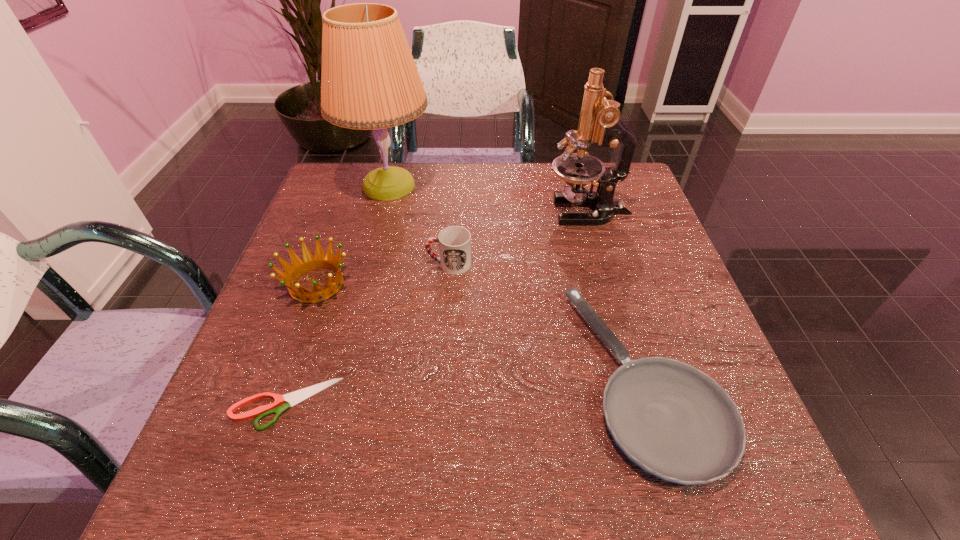
In the image, there is a desktop. Identify the location of vacant space at the right edge. The height and width of the screenshot is (540, 960). (653, 262).

This screenshot has width=960, height=540. In the image, there is a desktop. In order to click on free space at the far left corner in this screenshot , I will do `click(374, 165)`.

I want to click on free point between the cup and the crown, so click(x=383, y=274).

This screenshot has height=540, width=960. In order to click on free space between the microscope and the tallest object in this screenshot , I will do `click(489, 198)`.

Find the location of a particular element. empty location between the frying pan and the scissors is located at coordinates (466, 391).

Image resolution: width=960 pixels, height=540 pixels. Identify the location of vacant region between the fourth object from left to right and the second tallest object. (518, 237).

Identify the location of free space between the second shortest object and the lamp. This screenshot has height=540, width=960. point(517,282).

The image size is (960, 540). Identify the location of unoccupied position between the microscope and the scissors. (437, 307).

Where is `free spot between the tallest object and the second tallest object`? The height and width of the screenshot is (540, 960). free spot between the tallest object and the second tallest object is located at coordinates (489, 198).

You are a GUI agent. You are given a task and a screenshot of the screen. Output one action in this format:
    pyautogui.click(x=<x>, y=<y>)
    Task: Click on the empty space that is in between the crown and the fourth object from left to right
    This screenshot has width=960, height=540.
    Given the screenshot: What is the action you would take?
    pyautogui.click(x=383, y=274)